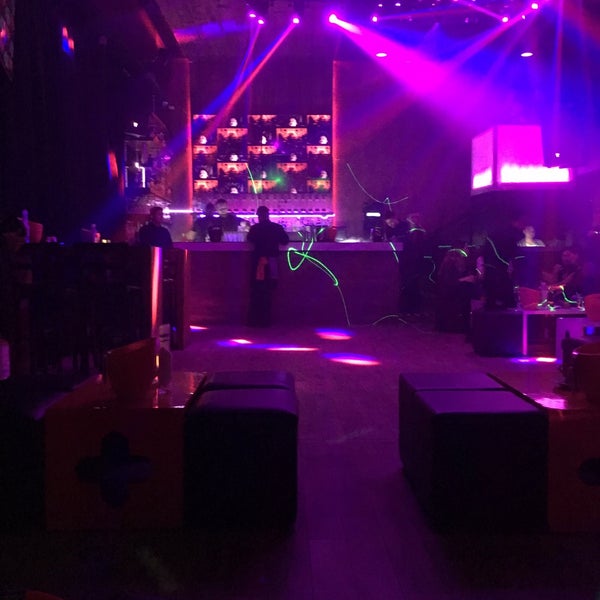
I want to click on wall, so click(x=408, y=182).